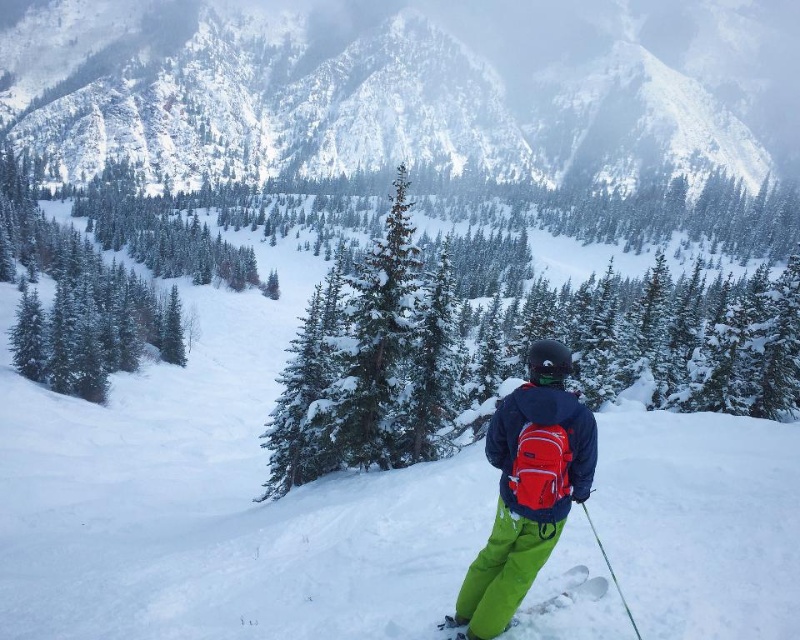
Can you confirm if snowy forested mountain at upper center is positioned to the right of green plastic ski pole at lower right?

Indeed, snowy forested mountain at upper center is positioned on the right side of green plastic ski pole at lower right.

Between snowy forested mountain at upper center and green plastic ski pole at lower right, which one is positioned lower?

green plastic ski pole at lower right is lower down.

Who is more forward, (x=658, y=86) or (x=628, y=618)?

Point (x=628, y=618)

Where is `snowy forested mountain at upper center`? snowy forested mountain at upper center is located at coordinates (412, 83).

You are a GUI agent. You are given a task and a screenshot of the screen. Output one action in this format:
    pyautogui.click(x=<x>, y=<y>)
    Task: Click on the white plastic ski at lower center
    The width and height of the screenshot is (800, 640).
    Given the screenshot: What is the action you would take?
    pyautogui.click(x=564, y=593)

Is white plastic ski at lower center positioned before green plastic ski pole at lower right?

No, white plastic ski at lower center is further to the viewer.

Describe the element at coordinates (564, 593) in the screenshot. Image resolution: width=800 pixels, height=640 pixels. I see `white plastic ski at lower center` at that location.

Where is `white plastic ski at lower center`? This screenshot has height=640, width=800. white plastic ski at lower center is located at coordinates (564, 593).

Does green matte ski pants at center lie in front of white plastic ski at lower center?

Yes, it is in front of white plastic ski at lower center.

The height and width of the screenshot is (640, 800). Identify the location of green matte ski pants at center. (528, 488).

You are a GUI agent. You are given a task and a screenshot of the screen. Output one action in this format:
    pyautogui.click(x=<x>, y=<y>)
    Task: Click on the green matte ski pants at center
    This screenshot has width=800, height=640.
    Given the screenshot: What is the action you would take?
    pyautogui.click(x=528, y=488)